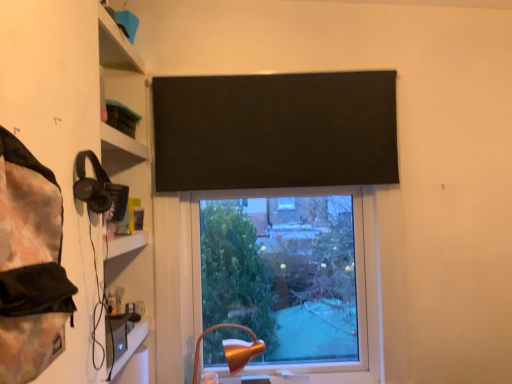
The height and width of the screenshot is (384, 512). Identify the location of black matte curtain at upper center. coord(275,130).

Describe the element at coordinates (275, 130) in the screenshot. I see `black matte curtain at upper center` at that location.

This screenshot has width=512, height=384. Identify the location of black matte curtain at upper center. pyautogui.click(x=275, y=130).